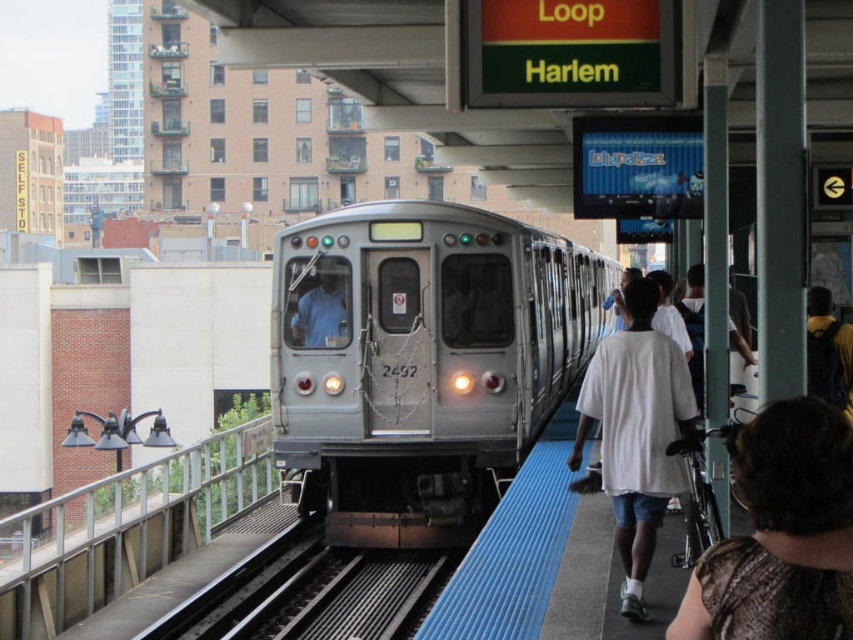
The width and height of the screenshot is (853, 640). What do you see at coordinates (781, 534) in the screenshot? I see `dark brown textured shirt at lower right` at bounding box center [781, 534].

Can you confirm if dark brown textured shirt at lower right is positioned below white cotton shirt at right?

Actually, dark brown textured shirt at lower right is above white cotton shirt at right.

Is point (689, 618) positioned after point (648, 481)?

No.

Where is `dark brown textured shirt at lower right`? dark brown textured shirt at lower right is located at coordinates (781, 534).

Does point (358, 381) lie in front of point (846, 529)?

No, (358, 381) is behind (846, 529).

Can you confirm if silver metallic train at center is smaller than dark brown textured shirt at lower right?

Incorrect, silver metallic train at center is not smaller in size than dark brown textured shirt at lower right.

Is point (515, 454) closer to camera compared to point (793, 401)?

No, (515, 454) is behind (793, 401).

At what (x,y) coordinates should I click in order to perform the action: click on silver metallic train at center. Please return your answer as a coordinate pair (x, y). The image size is (853, 640). Looking at the image, I should click on (421, 362).

Does silver metallic train at center have a greater width compared to white cotton shirt at right?

Indeed, silver metallic train at center has a greater width compared to white cotton shirt at right.

In the scene shown: Who is taller, silver metallic train at center or white cotton shirt at right?

Standing taller between the two is silver metallic train at center.

Find the location of a particular element. silver metallic train at center is located at coordinates (421, 362).

This screenshot has height=640, width=853. In order to click on silver metallic train at center in this screenshot , I will do `click(421, 362)`.